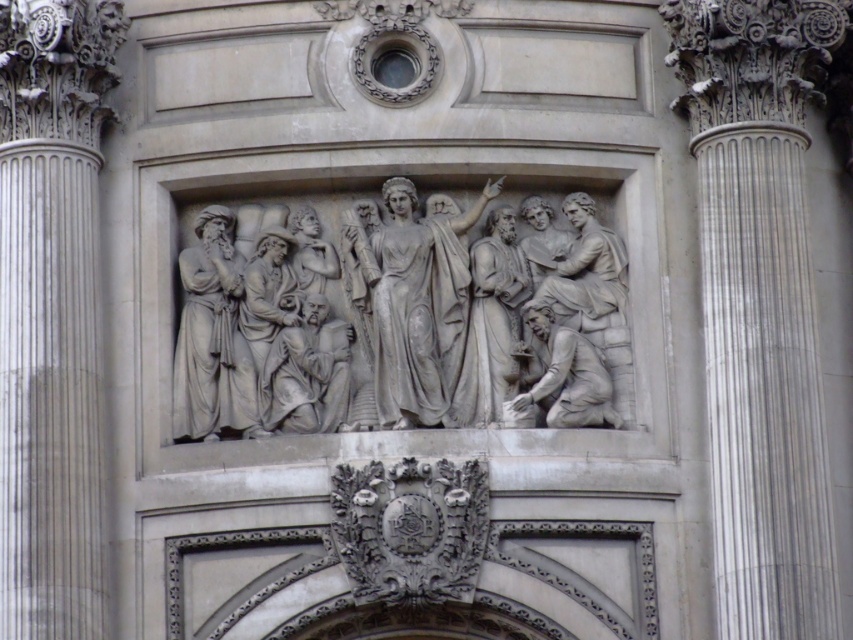
Question: Among these objects, which one is nearest to the camera?

Choices:
 (A) white marble column at right
 (B) gray stone statue at center
 (C) gray stone relief at center
 (D) gray stone figure at lower right

Answer: (A)

Question: Is gray stone relief at center smaller than gray stone figure at left?

Choices:
 (A) no
 (B) yes

Answer: (A)

Question: Which of the following is the farthest from the observer?

Choices:
 (A) (561, 364)
 (B) (78, 60)

Answer: (B)

Question: Does white marble column at right appear on the right side of gray stone figure at lower right?

Choices:
 (A) yes
 (B) no

Answer: (A)

Question: Estimate the real-world distances between objects in this image. Which object is farther from the gray stone figure at lower right?

Choices:
 (A) white marble column at right
 (B) gray stone figure at left
 (C) white marble column at left

Answer: (C)

Question: Observing the image, what is the correct spatial positioning of white marble column at right in reference to white marble column at left?

Choices:
 (A) left
 (B) right

Answer: (B)